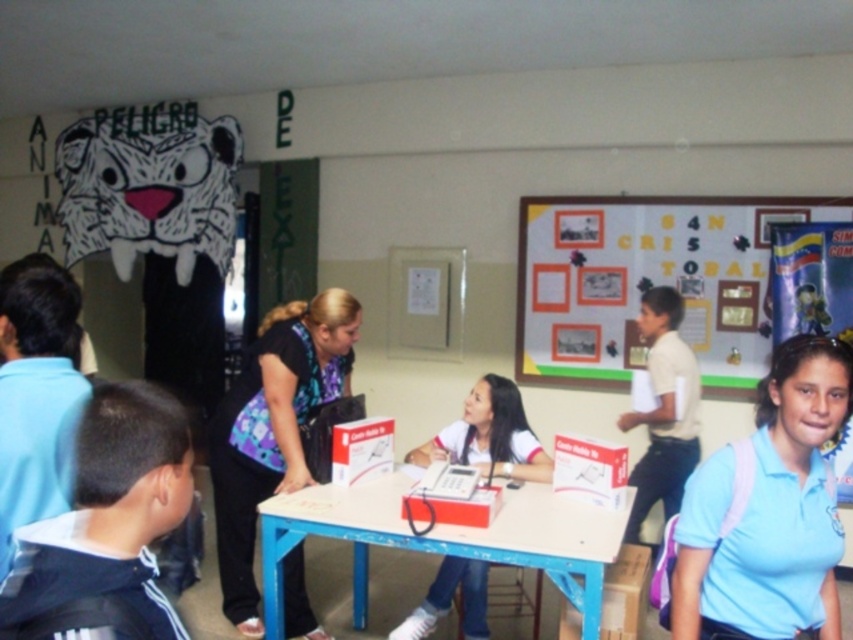
Does white plastic table at center appear under white shirt at right?

Indeed, white plastic table at center is positioned under white shirt at right.

Who is positioned more to the left, white plastic table at center or white shirt at right?

From the viewer's perspective, white plastic table at center appears more on the left side.

Who is more forward, (349, 486) or (637, 324)?

Point (349, 486) is in front.

I want to click on white plastic table at center, so click(x=445, y=538).

Who is shorter, blue printed blouse at center or white shirt at right?

white shirt at right

Describe the element at coordinates (273, 428) in the screenshot. The width and height of the screenshot is (853, 640). I see `blue printed blouse at center` at that location.

Where is `blue printed blouse at center`? The width and height of the screenshot is (853, 640). blue printed blouse at center is located at coordinates (273, 428).

Identify the location of white paperboard bulletin board at upper right. Image resolution: width=853 pixels, height=640 pixels. (648, 282).

Between white paperboard bulletin board at upper right and white matte uniform at center, which one appears on the left side from the viewer's perspective?

Positioned to the left is white matte uniform at center.

Which is behind, point (534, 227) or point (451, 436)?

The point (534, 227) is behind.

Image resolution: width=853 pixels, height=640 pixels. I want to click on white paperboard bulletin board at upper right, so click(648, 282).